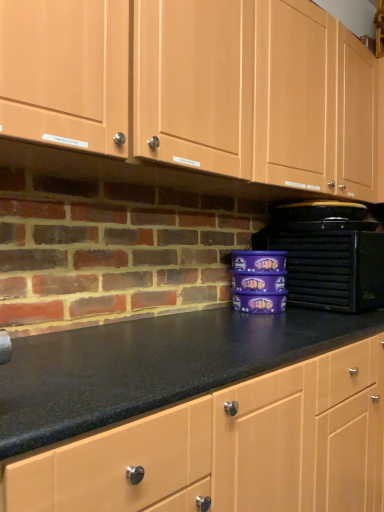
Question: Is matte wood cabinets at upper center positioned with its back to black plastic toaster at right?

Choices:
 (A) no
 (B) yes

Answer: (A)

Question: Could black plastic toaster at right be considered to be inside matte wood cabinets at upper center?

Choices:
 (A) no
 (B) yes

Answer: (A)

Question: From a real-world perspective, is matte wood cabinets at upper center on top of black plastic toaster at right?

Choices:
 (A) yes
 (B) no

Answer: (A)

Question: Does matte wood cabinets at upper center turn towards black plastic toaster at right?

Choices:
 (A) yes
 (B) no

Answer: (B)

Question: Is matte wood cabinets at upper center at the right side of black plastic toaster at right?

Choices:
 (A) no
 (B) yes

Answer: (A)

Question: Is matte wood cabinets at upper center far from black plastic toaster at right?

Choices:
 (A) yes
 (B) no

Answer: (B)

Question: Would you say black plastic toaster at right is a long distance from matte wood cabinets at upper center?

Choices:
 (A) yes
 (B) no

Answer: (B)

Question: Is black plastic toaster at right facing away from matte wood cabinets at upper center?

Choices:
 (A) yes
 (B) no

Answer: (B)

Question: Can you confirm if black plastic toaster at right is smaller than matte wood cabinets at upper center?

Choices:
 (A) no
 (B) yes

Answer: (B)

Question: Does black plastic toaster at right have a larger size compared to matte wood cabinets at upper center?

Choices:
 (A) yes
 (B) no

Answer: (B)

Question: From a real-world perspective, is black plastic toaster at right located higher than matte wood cabinets at upper center?

Choices:
 (A) no
 (B) yes

Answer: (A)

Question: From the image's perspective, would you say black plastic toaster at right is positioned over matte wood cabinets at upper center?

Choices:
 (A) yes
 (B) no

Answer: (B)

Question: Visually, is matte wood cabinets at upper center positioned to the left or to the right of black plastic toaster at right?

Choices:
 (A) right
 (B) left

Answer: (B)